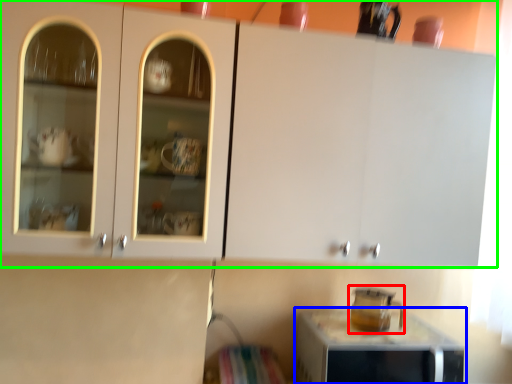
Question: Considering the real-world distances, which object is closest to appliance (highlighted by a red box)? home appliance (highlighted by a blue box) or cabinetry (highlighted by a green box).

Choices:
 (A) home appliance
 (B) cabinetry

Answer: (A)